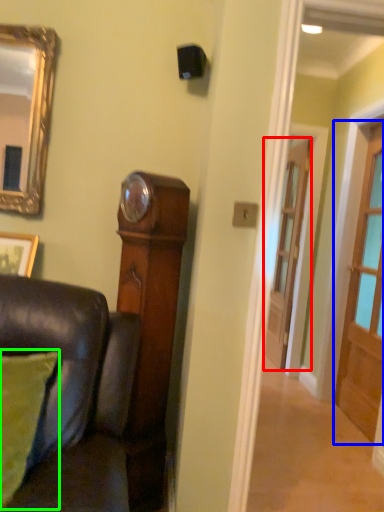
Question: Considering the real-world distances, which object is closest to door (highlighted by a red box)? door (highlighted by a blue box) or pillow (highlighted by a green box).

Choices:
 (A) door
 (B) pillow

Answer: (A)